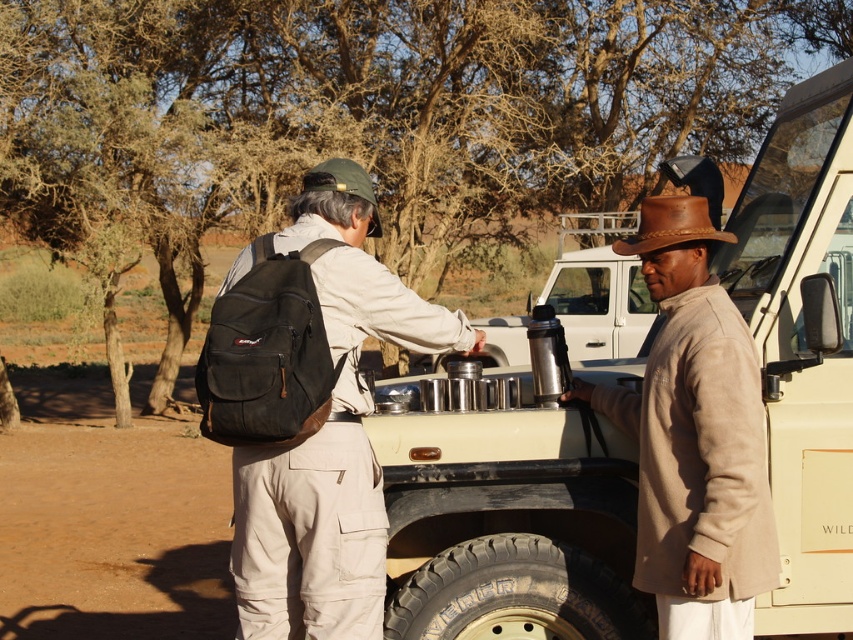
What do you see at coordinates (508, 524) in the screenshot?
I see `metallic beige jeep at center` at bounding box center [508, 524].

Is metallic beige jeep at center thinner than tan suede hat at right?

Yes, metallic beige jeep at center is thinner than tan suede hat at right.

Measure the distance between metallic beige jeep at center and camera.

3.69 meters

The width and height of the screenshot is (853, 640). I want to click on metallic beige jeep at center, so click(x=508, y=524).

What do you see at coordinates (694, 435) in the screenshot? I see `tan suede hat at right` at bounding box center [694, 435].

Is point (695, 374) positioned in front of point (657, 246)?

Yes.

Consider the image. Who is more forward, (686,237) or (653,244)?

Positioned in front is point (686,237).

The image size is (853, 640). In order to click on tan suede hat at right in this screenshot , I will do `click(694, 435)`.

Between point (351, 323) and point (627, 237), which one is positioned behind?

Positioned behind is point (627, 237).

Measure the distance between point (271,547) and camera.

The distance of point (271,547) from camera is 11.51 feet.

This screenshot has height=640, width=853. What are the coordinates of `matte black backpack at center` in the screenshot? It's located at (328, 429).